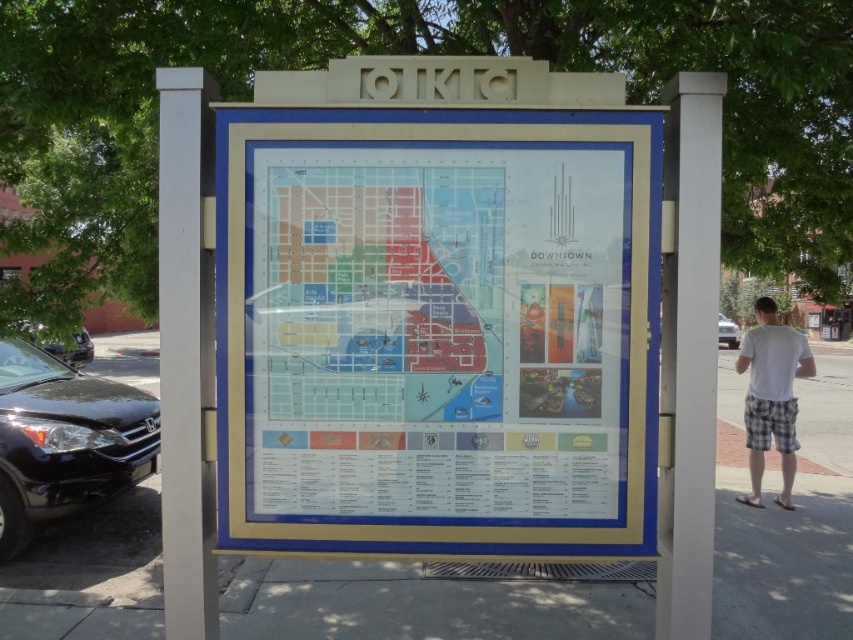
Does matte plastic map at center appear on the left side of white plaid shorts at lower right?

Indeed, matte plastic map at center is positioned on the left side of white plaid shorts at lower right.

Between matte plastic map at center and white plaid shorts at lower right, which one has more height?

white plaid shorts at lower right is taller.

Which is behind, point (271, 202) or point (804, 346)?

The point (804, 346) is more distant.

Where is `matte plastic map at center`? matte plastic map at center is located at coordinates (437, 333).

Can you confirm if white plastic map at center is positioned to the right of gray concrete pavement at center?

No, white plastic map at center is not to the right of gray concrete pavement at center.

Consider the image. Is white plastic map at center taller than gray concrete pavement at center?

Indeed, white plastic map at center has a greater height compared to gray concrete pavement at center.

Does point (244, 216) come behind point (730, 380)?

No, (244, 216) is in front of (730, 380).

Identify the location of white plastic map at center. The height and width of the screenshot is (640, 853). (439, 323).

Which of these two, white plastic map at center or white plaid shorts at lower right, stands shorter?

white plastic map at center is shorter.

Can you confirm if white plastic map at center is bigger than white plaid shorts at lower right?

No.

Between point (508, 314) and point (751, 465), which one is positioned in front?

Point (508, 314) is in front.

You are a GUI agent. You are given a task and a screenshot of the screen. Output one action in this format:
    pyautogui.click(x=<x>, y=<y>)
    Task: Click on the white plastic map at center
    The width and height of the screenshot is (853, 640).
    Given the screenshot: What is the action you would take?
    pyautogui.click(x=439, y=323)